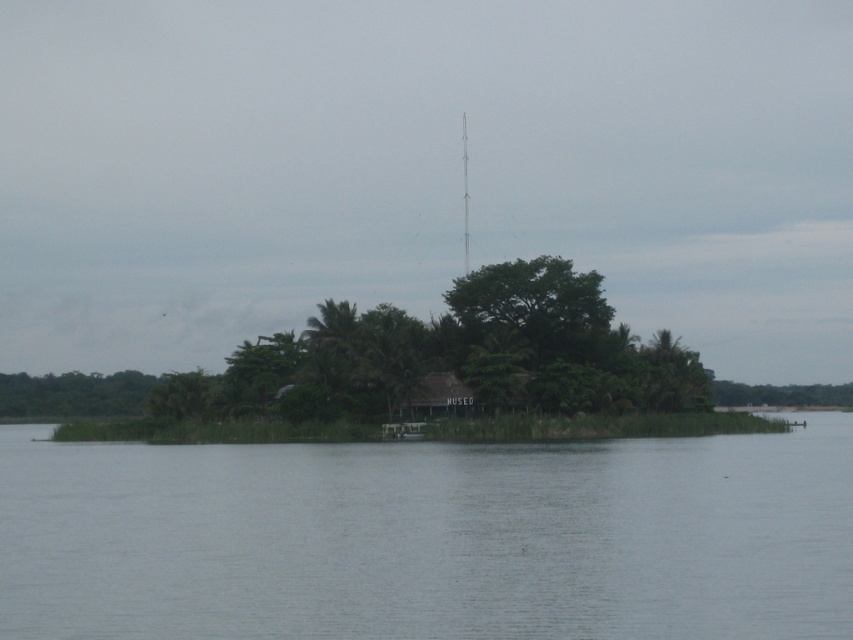
Question: Can you confirm if green leafy tree at center is thinner than brown thatched hut at center?

Choices:
 (A) yes
 (B) no

Answer: (B)

Question: Estimate the real-world distances between objects in this image. Which object is farther from the clear water at center?

Choices:
 (A) brown thatched hut at center
 (B) green leafy tree at center

Answer: (A)

Question: Does clear water at center appear over green leafy tree at center?

Choices:
 (A) yes
 (B) no

Answer: (B)

Question: Among these objects, which one is nearest to the camera?

Choices:
 (A) clear water at center
 (B) green leafy tree at center
 (C) brown thatched hut at center

Answer: (A)

Question: Is clear water at center positioned in front of brown thatched hut at center?

Choices:
 (A) yes
 (B) no

Answer: (A)

Question: Which point is farther to the camera?

Choices:
 (A) (428, 387)
 (B) (532, 360)

Answer: (B)